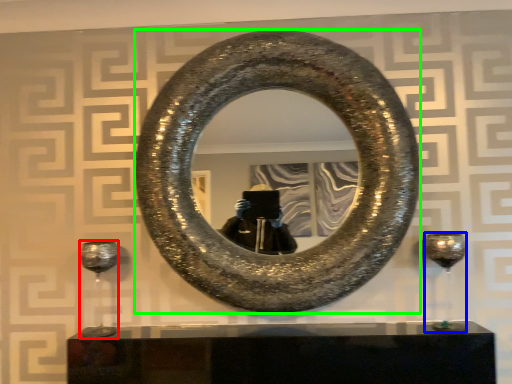
Question: Which object is positioned closest to wine glass (highlighted by a red box)? Select from wine glass (highlighted by a blue box) and horseshoe (highlighted by a green box).

Choices:
 (A) wine glass
 (B) horseshoe

Answer: (B)